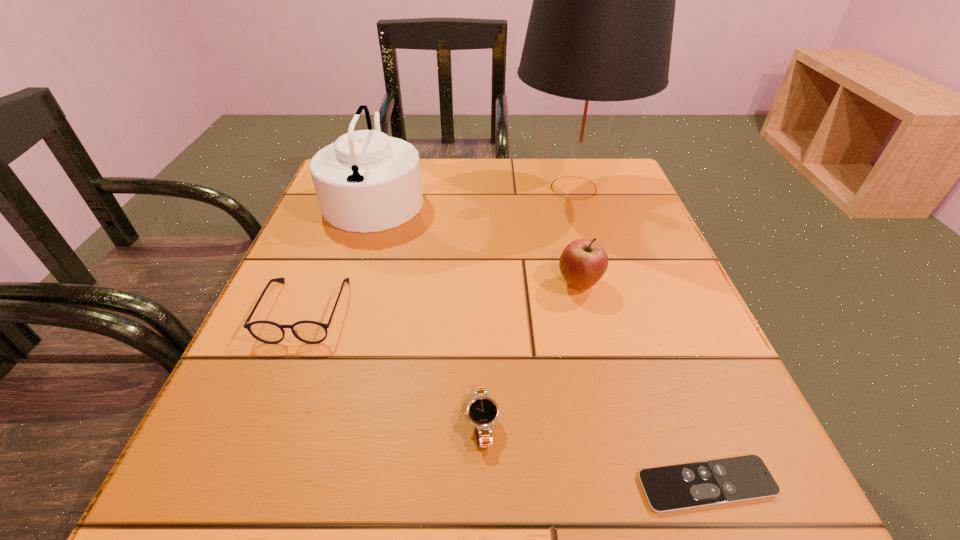
You are a GUI agent. You are given a task and a screenshot of the screen. Output one action in this format:
    pyautogui.click(x=<x>, y=<y>)
    Task: Click on the lampshade present at the right edge
    
    Given the screenshot: What is the action you would take?
    pyautogui.click(x=600, y=30)

You are a GUI agent. You are given a task and a screenshot of the screen. Output one action in this format:
    pyautogui.click(x=<x>, y=<y>)
    Task: Click on the apple present at the right edge
    This screenshot has width=960, height=540.
    Given the screenshot: What is the action you would take?
    pyautogui.click(x=583, y=262)

Identify the location of remote control that is at the right edge. (683, 486).

At what (x,y) coordinates should I click in order to perform the action: click on object that is at the far left corner. Please return your answer as a coordinate pair (x, y). Looking at the image, I should click on (366, 181).

Find the location of a particular element. The height and width of the screenshot is (540, 960). object located in the far right corner section of the desktop is located at coordinates (600, 30).

Where is `object that is at the near right corner`? object that is at the near right corner is located at coordinates (683, 486).

This screenshot has height=540, width=960. In order to click on free space at the far edge in this screenshot , I will do `click(496, 193)`.

This screenshot has height=540, width=960. In the image, there is a desktop. Find the location of `vacant space at the left edge`. vacant space at the left edge is located at coordinates (334, 266).

You are a GUI agent. You are given a task and a screenshot of the screen. Output one action in this format:
    pyautogui.click(x=<x>, y=<y>)
    Task: Click on the vacant space at the right edge of the desktop
    
    Given the screenshot: What is the action you would take?
    pyautogui.click(x=663, y=305)

In the image, there is a desktop. In order to click on free space at the near right corner in this screenshot , I will do `click(758, 510)`.